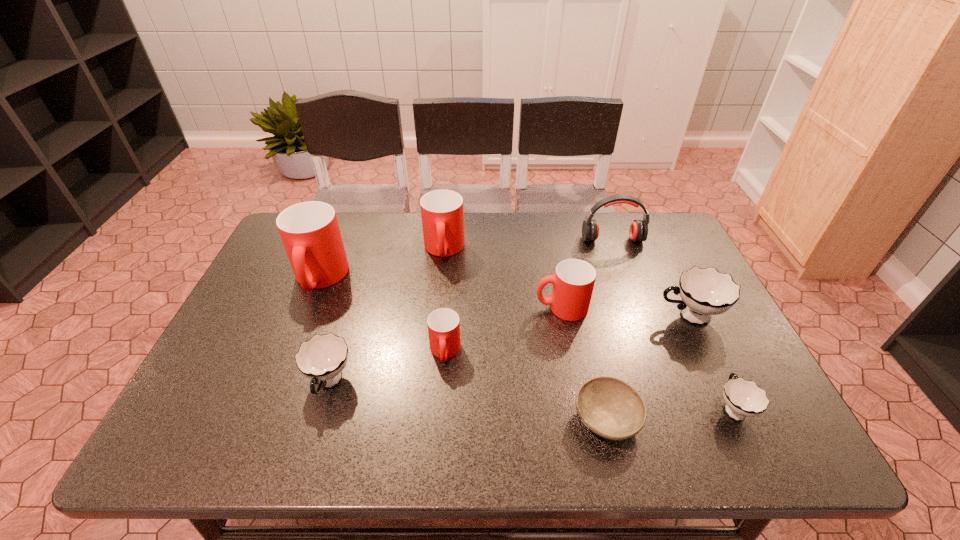
This screenshot has height=540, width=960. What are the coordinates of `object identified as the third closest to the sixth shortest cup` in the screenshot? It's located at (443, 324).

Identify the location of cup that stands as the sixth closest to the rightmost red cup. This screenshot has height=540, width=960. (310, 233).

Where is `the fourth closest cup to the nearest red cup`? The image size is (960, 540). the fourth closest cup to the nearest red cup is located at coordinates (310, 233).

Locate an element on the screen. the closest red cup to the fifth cup from left to right is located at coordinates (443, 324).

Locate an element on the screen. This screenshot has height=540, width=960. red cup that is the closest one to the nearest red cup is located at coordinates (573, 282).

Image resolution: width=960 pixels, height=540 pixels. Identify the location of the closest white cup relative to the farthest white cup. [743, 398].

Locate an element on the screen. white cup that is the closest to the second biggest white cup is located at coordinates (704, 292).

This screenshot has width=960, height=540. Find the location of `free spot that satisfies the following two spatial constraints: 1. on the side of the sixth shortest cup with the handle; 2. on the side of the third biggest red cup with the handle`. free spot that satisfies the following two spatial constraints: 1. on the side of the sixth shortest cup with the handle; 2. on the side of the third biggest red cup with the handle is located at coordinates (439, 308).

At what (x,y) coordinates should I click in order to perform the action: click on vacant space that satisfies the following two spatial constraints: 1. on the side of the third biggest red cup with the handle; 2. on the side of the second biggest red cup with the handle. Please return your answer as a coordinate pair (x, y). Image resolution: width=960 pixels, height=540 pixels. Looking at the image, I should click on (550, 249).

The width and height of the screenshot is (960, 540). I want to click on blank area in the image that satisfies the following two spatial constraints: 1. on the side of the farthest white cup with the handle; 2. on the side of the third smallest red cup with the handle, so click(657, 249).